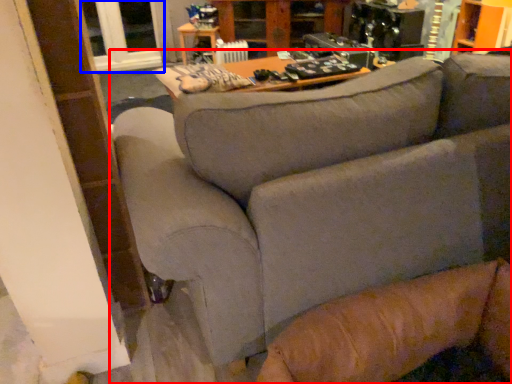
Question: Which point is closer to the camera, studio couch (highlighted by a red box) or window (highlighted by a blue box)?

Choices:
 (A) studio couch
 (B) window

Answer: (A)